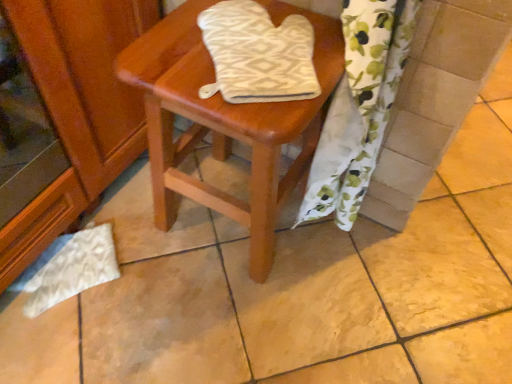
What are the coordinates of `vacant space positioned to the left of white textured oven mitt at center` in the screenshot? It's located at (174, 56).